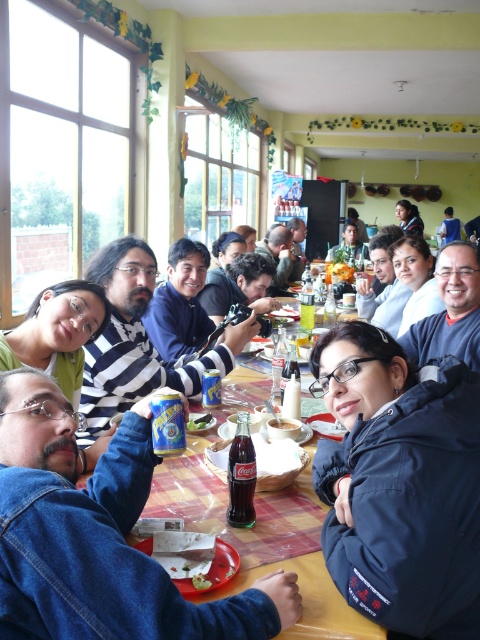
You are a guest at this event and want to place your dark blue jacket at lower right on the table where the white matte bowl at center is located. Is there enough space for the jacket above the bowl?

The dark blue jacket at lower right is located above the white matte bowl at center, so there is space for the jacket above the bowl.

You are organizing a coat rack at the entrance of the event venue. You have two jackets to hang up. The dark blue jacket at lower right and the blue denim jacket at upper right. Which jacket will require more horizontal space on the coat rack?

The blue denim jacket at upper right requires more horizontal space on the coat rack because its width is greater than the dark blue jacket at lower right.

You are a guest at the event and need to place a small gift on the table. The gift requires a flat surface. Which object on the table, the dark blue jacket at lower right or the white matte bowl at center, is more suitable for placing the gift?

The white matte bowl at center is more suitable for placing the gift because the dark blue jacket at lower right is positioned to the right of it, meaning the bowl is likely on the table while the jacket may be hanging or placed off the table surface.